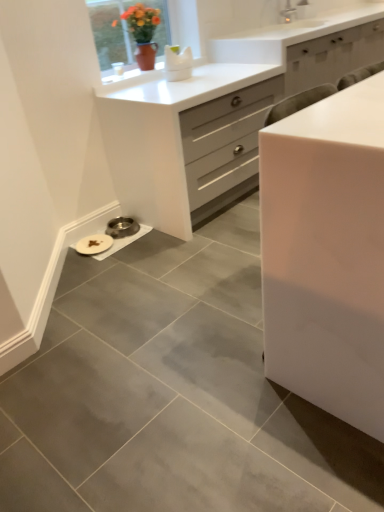
Question: Which direction should I rotate to face white glossy chest of drawers at center, placed as the second chest of drawers when sorted from front to back, — up or down?

Choices:
 (A) down
 (B) up

Answer: (B)

Question: Does white glossy chest of drawers at center, placed as the second chest of drawers when sorted from front to back, have a greater width compared to matte ceramic vase at upper center?

Choices:
 (A) no
 (B) yes

Answer: (B)

Question: Could you tell me if white glossy chest of drawers at center, the first chest of drawers when ordered from back to front, is turned towards matte ceramic vase at upper center?

Choices:
 (A) no
 (B) yes

Answer: (A)

Question: Is white glossy chest of drawers at center, the first chest of drawers when ordered from back to front, smaller than matte ceramic vase at upper center?

Choices:
 (A) no
 (B) yes

Answer: (A)

Question: Is white glossy chest of drawers at center, the first chest of drawers when ordered from back to front, not near matte ceramic vase at upper center?

Choices:
 (A) yes
 (B) no

Answer: (B)

Question: Does white glossy chest of drawers at center, placed as the second chest of drawers when sorted from front to back, contain matte ceramic vase at upper center?

Choices:
 (A) no
 (B) yes

Answer: (A)

Question: Is white glossy chest of drawers at center, the first chest of drawers when ordered from back to front, shorter than matte ceramic vase at upper center?

Choices:
 (A) no
 (B) yes

Answer: (A)

Question: Can you confirm if matte ceramic vase at upper center is bigger than white glossy chest of drawers at center, placed as the second chest of drawers when sorted from front to back?

Choices:
 (A) no
 (B) yes

Answer: (A)

Question: From the image's perspective, would you say matte ceramic vase at upper center is shown under white glossy chest of drawers at center, placed as the second chest of drawers when sorted from front to back?

Choices:
 (A) no
 (B) yes

Answer: (A)

Question: From a real-world perspective, does matte ceramic vase at upper center sit lower than white glossy chest of drawers at center, the first chest of drawers when ordered from back to front?

Choices:
 (A) yes
 (B) no

Answer: (B)

Question: Can you confirm if matte ceramic vase at upper center is taller than white glossy chest of drawers at center, the first chest of drawers when ordered from back to front?

Choices:
 (A) yes
 (B) no

Answer: (B)

Question: Is matte ceramic vase at upper center oriented towards white glossy chest of drawers at center, the first chest of drawers when ordered from back to front?

Choices:
 (A) no
 (B) yes

Answer: (A)

Question: Would you say matte ceramic vase at upper center contains white glossy chest of drawers at center, placed as the second chest of drawers when sorted from front to back?

Choices:
 (A) no
 (B) yes

Answer: (A)

Question: Is matte ceramic vase at upper center wider than white glossy cabinet at center, marked as the first chest of drawers in a front-to-back arrangement?

Choices:
 (A) yes
 (B) no

Answer: (A)